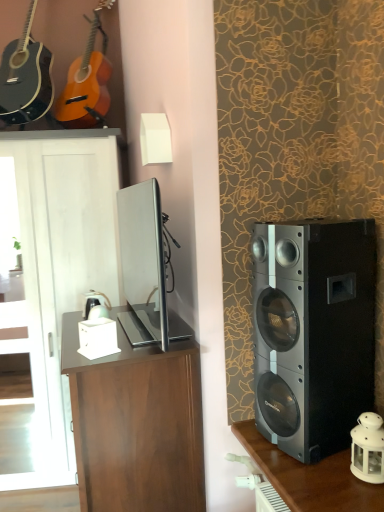
In order to click on vacant region to the left of white glass lantern at lower right in this screenshot , I will do `click(317, 475)`.